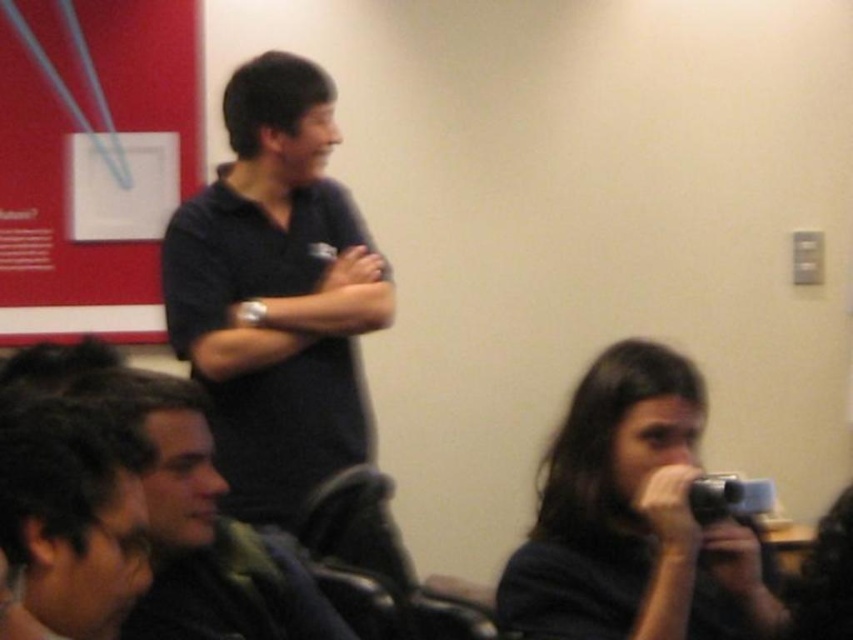
You are standing in the room and want to take a photo of the presenter in the background. The dark matte camera at lower right is located at point (x=634, y=518). Is the camera within your reach to take the photo?

The dark matte camera at lower right is located at point (x=634, y=518). Since the camera is at your lower right, it is within your reach to take the photo.

You are standing in the room and want to move from point A to point B. Point A is at coordinates point (601, 600) and point B is at coordinates point (42, 438). Which point is closer to you?

Point (601, 600) is further to the viewer than point (42, 438), so point B is closer to you.

You are attending a presentation and want to take a photo of the speaker wearing the black matte shirt at center without including the dark brown hair at lower left in the frame. Is this possible based on their positions?

Yes, the dark brown hair at lower left is behind the black matte shirt at center, so you can take a photo of the speaker wearing the black matte shirt at center without including the dark brown hair at lower left in the frame.